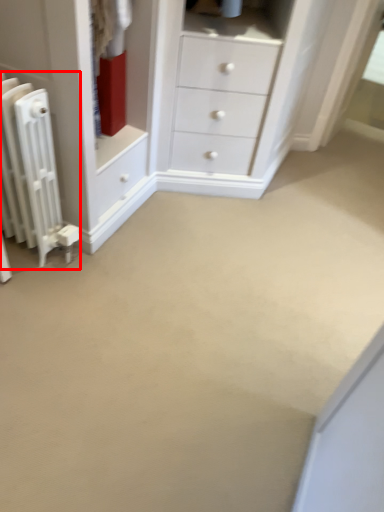
Question: From the image's perspective, what is the correct spatial positioning of radiator (annotated by the red box) in reference to chest of drawers?

Choices:
 (A) below
 (B) above

Answer: (A)